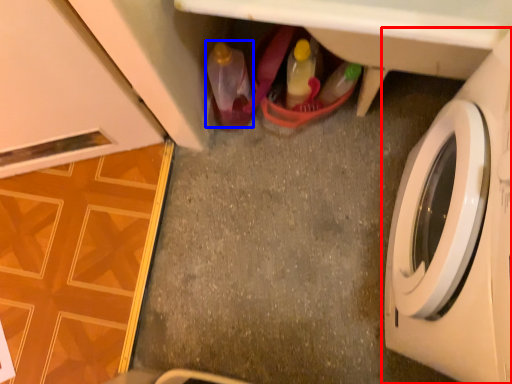
Question: Which object appears farthest to the camera in this image, washing machine (highlighted by a red box) or bottle (highlighted by a blue box)?

Choices:
 (A) washing machine
 (B) bottle

Answer: (B)